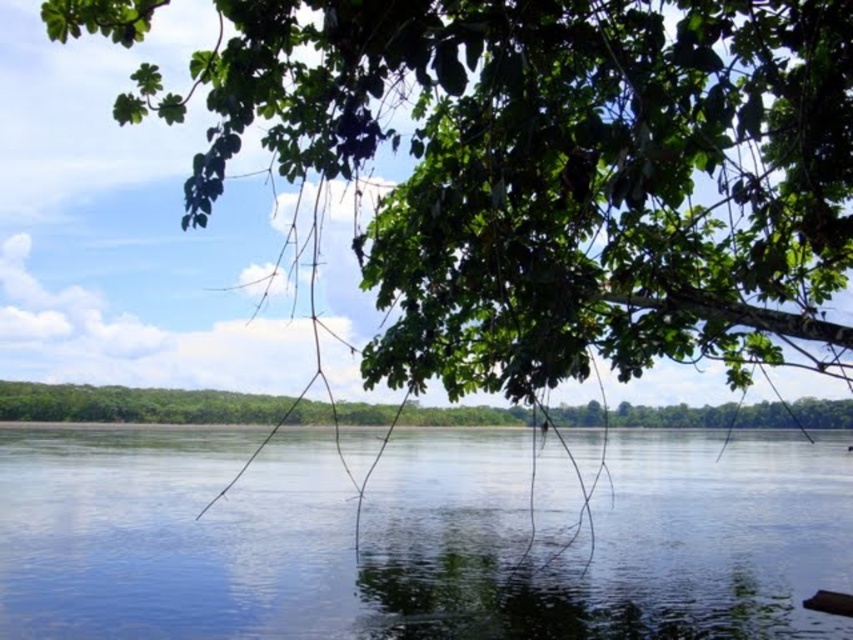
You are a photographer planning to take a photo of the transparent water at center and the green leafy tree at center. Based on their sizes in the scene, which one would appear larger in the photo?

The transparent water at center appears much taller than the green leafy tree at center, so it would be larger in the photo.

You are standing at the riverside and want to take a photo of the point at coordinates point [299,42]. If your camera has a maximum focus range of 5 meters, will it be able to focus on that point?

The distance of point [299,42] from camera is 5.65 meters. Since the camera can only focus up to 5 meters, it will not be able to focus on that point.

You are standing at the riverside and see two points marked in the scene. The first point is at coordinates point (601, 125) and the second is at point (85, 412). Which point is closer to you?

Point (601, 125) is in front of point (85, 412), so it is closer to you.